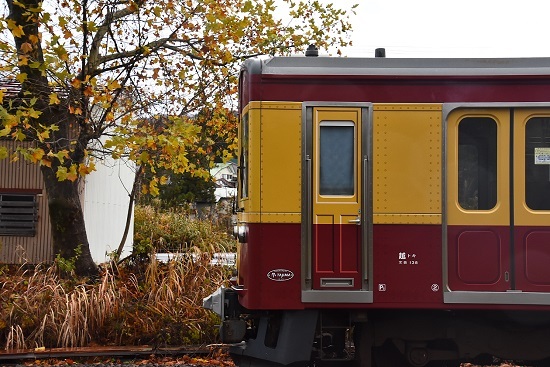
What are the coordinates of `handle` in the screenshot? It's located at (360, 221).